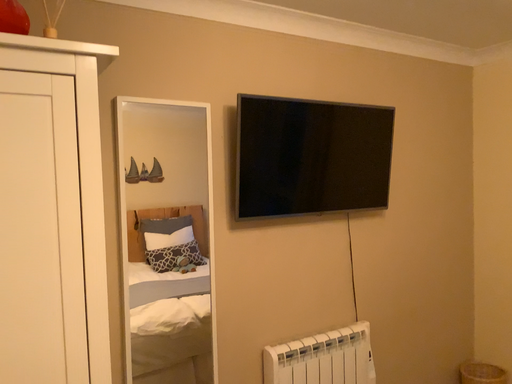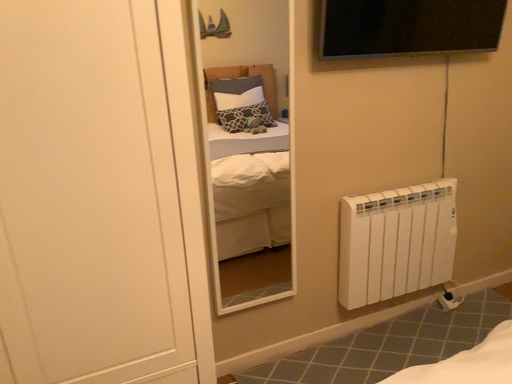
Question: Which way did the camera rotate in the video?

Choices:
 (A) rotated left
 (B) rotated right

Answer: (A)